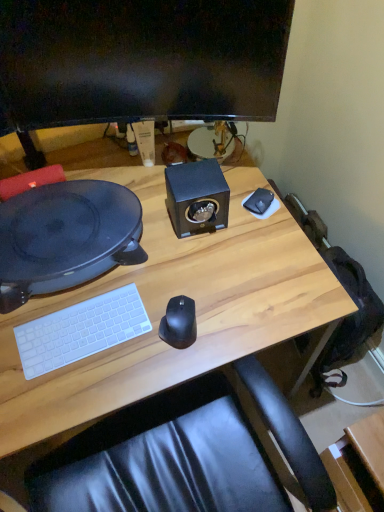
This screenshot has height=512, width=384. I want to click on unoccupied region to the right of black plastic record player at left, so click(202, 253).